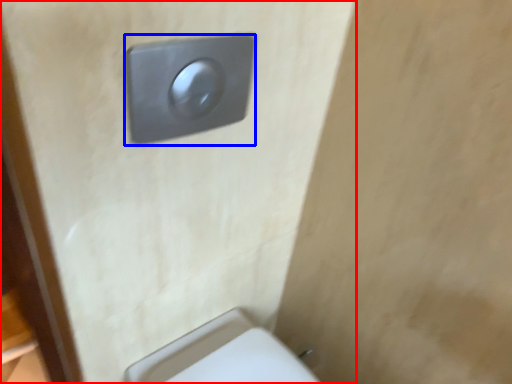
Question: Which object is closer to the camera taking this photo, door (highlighted by a red box) or light switch (highlighted by a blue box)?

Choices:
 (A) door
 (B) light switch

Answer: (A)